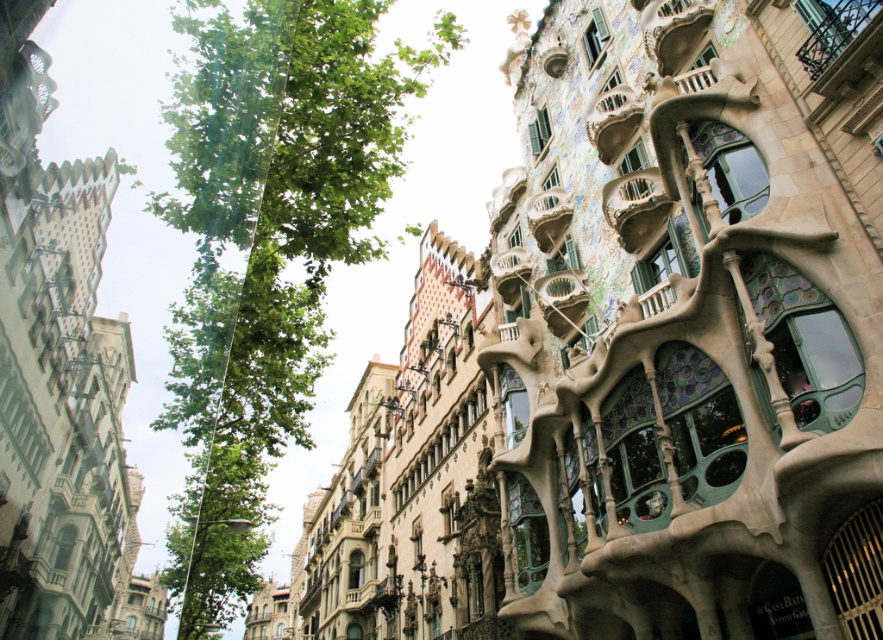
Question: Is green leafy tree at center wider than carved stone balcony at upper right?

Choices:
 (A) no
 (B) yes

Answer: (B)

Question: Does carved stone balcony at upper right appear on the right side of multicolored mosaic balcony at upper center?

Choices:
 (A) yes
 (B) no

Answer: (A)

Question: Which point is closer to the camera?

Choices:
 (A) [x=227, y=554]
 (B) [x=557, y=216]

Answer: (B)

Question: Does stained glass balcony at upper right have a smaller size compared to carved stone balcony at upper right?

Choices:
 (A) no
 (B) yes

Answer: (B)

Question: Estimate the real-world distances between objects in this image. Which object is farther from the green leafy tree at center?

Choices:
 (A) multicolored mosaic balcony at upper center
 (B) carved stone balcony at upper right

Answer: (B)

Question: Among these objects, which one is farthest from the camera?

Choices:
 (A) multicolored mosaic balcony at upper center
 (B) stained glass balcony at upper right
 (C) green leafy tree at center
 (D) carved stone balcony at upper right

Answer: (A)